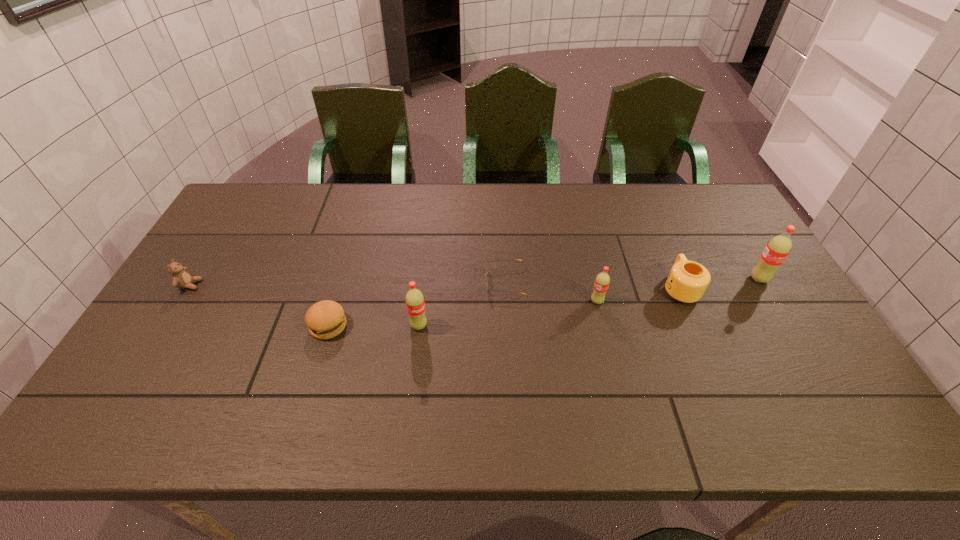
The sodas are evenly distributed in the image. To maintain this, where would you place another soda on the left? Please point to a free space. Please provide its 2D coordinates. Your answer should be formatted as a tuple, i.e. [(x, y)], where the tuple contains the x and y coordinates of a point satisfying the conditions above.

[(222, 353)]